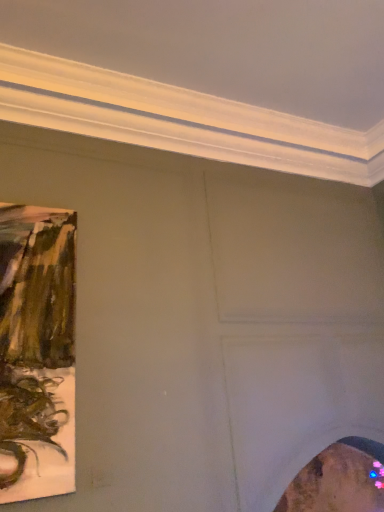
What do you see at coordinates (37, 351) in the screenshot? The image size is (384, 512). I see `matte brown painting at left, the 1th picture frame positioned from the left` at bounding box center [37, 351].

Where is `matte brown painting at left, which is the 2th picture frame from bottom to top`? Image resolution: width=384 pixels, height=512 pixels. matte brown painting at left, which is the 2th picture frame from bottom to top is located at coordinates (37, 351).

I want to click on wooden frame at lower right, which is the 2th picture frame in front-to-back order, so click(x=339, y=480).

The height and width of the screenshot is (512, 384). Describe the element at coordinates (339, 480) in the screenshot. I see `wooden frame at lower right, which ranks as the first picture frame in bottom-to-top order` at that location.

In order to click on matte brown painting at left, the 1th picture frame positioned from the left in this screenshot , I will do `click(37, 351)`.

Does matte brown painting at left, which is the 2th picture frame in back-to-front order, appear on the right side of wooden frame at lower right, arranged as the 1th picture frame when viewed from the back?

No, matte brown painting at left, which is the 2th picture frame in back-to-front order, is not to the right of wooden frame at lower right, arranged as the 1th picture frame when viewed from the back.

Between matte brown painting at left, which is the 2th picture frame in back-to-front order, and wooden frame at lower right, which ranks as the first picture frame in bottom-to-top order, which one is positioned in front?

Positioned in front is matte brown painting at left, which is the 2th picture frame in back-to-front order.

Which point is more forward, (73, 482) or (366, 444)?

Point (73, 482)

Based on the photo, from the image's perspective, which is below, matte brown painting at left, which is the first picture frame in front-to-back order, or wooden frame at lower right, the 2th picture frame viewed from the left?

From the image's view, wooden frame at lower right, the 2th picture frame viewed from the left, is below.

From a real-world perspective, between matte brown painting at left, which is the 2th picture frame in back-to-front order, and wooden frame at lower right, the 2th picture frame viewed from the left, who is vertically higher?

matte brown painting at left, which is the 2th picture frame in back-to-front order, from a real-world perspective.

Is matte brown painting at left, which is the first picture frame in front-to-back order, thinner than wooden frame at lower right, which ranks as the first picture frame in right-to-left order?

Indeed, matte brown painting at left, which is the first picture frame in front-to-back order, has a lesser width compared to wooden frame at lower right, which ranks as the first picture frame in right-to-left order.

Does matte brown painting at left, the 1th picture frame positioned from the left, have a lesser height compared to wooden frame at lower right, the 2th picture frame viewed from the left?

In fact, matte brown painting at left, the 1th picture frame positioned from the left, may be taller than wooden frame at lower right, the 2th picture frame viewed from the left.

In terms of size, does matte brown painting at left, which is the 2th picture frame in back-to-front order, appear bigger or smaller than wooden frame at lower right, which is the 2th picture frame in front-to-back order?

In the image, matte brown painting at left, which is the 2th picture frame in back-to-front order, appears to be smaller than wooden frame at lower right, which is the 2th picture frame in front-to-back order.

Can we say matte brown painting at left, which is the 2th picture frame in back-to-front order, lies outside wooden frame at lower right, which is the 2th picture frame in front-to-back order?

That's correct, matte brown painting at left, which is the 2th picture frame in back-to-front order, is outside of wooden frame at lower right, which is the 2th picture frame in front-to-back order.

Is matte brown painting at left, the second picture frame in the right-to-left sequence, touching wooden frame at lower right, the 2th picture frame viewed from the left?

No.

Does matte brown painting at left, which is the first picture frame in front-to-back order, turn towards wooden frame at lower right, the 2th picture frame viewed from the left?

No, matte brown painting at left, which is the first picture frame in front-to-back order, is not oriented towards wooden frame at lower right, the 2th picture frame viewed from the left.

This screenshot has width=384, height=512. Identify the location of picture frame in front of the wooden frame at lower right, arranged as the 1th picture frame when viewed from the back. (37, 351).

Does wooden frame at lower right, which ranks as the first picture frame in right-to-left order, appear on the left side of matte brown painting at left, which is the 2th picture frame from bottom to top?

No, wooden frame at lower right, which ranks as the first picture frame in right-to-left order, is not to the left of matte brown painting at left, which is the 2th picture frame from bottom to top.

Which object is more forward, wooden frame at lower right, which ranks as the first picture frame in bottom-to-top order, or matte brown painting at left, which is the first picture frame in front-to-back order?

matte brown painting at left, which is the first picture frame in front-to-back order, is in front.

Does point (338, 447) come closer to viewer compared to point (37, 272)?

No.

From the image's perspective, is wooden frame at lower right, which ranks as the first picture frame in right-to-left order, on matte brown painting at left, which is the 2th picture frame in back-to-front order?

Incorrect, from the image's perspective, wooden frame at lower right, which ranks as the first picture frame in right-to-left order, is lower than matte brown painting at left, which is the 2th picture frame in back-to-front order.

From a real-world perspective, is wooden frame at lower right, which ranks as the first picture frame in right-to-left order, physically above matte brown painting at left, which is the first picture frame in front-to-back order?

No.

Is wooden frame at lower right, which ranks as the first picture frame in bottom-to-top order, wider than matte brown painting at left, positioned as the first picture frame in top-to-bottom order?

Correct, the width of wooden frame at lower right, which ranks as the first picture frame in bottom-to-top order, exceeds that of matte brown painting at left, positioned as the first picture frame in top-to-bottom order.

Consider the image. Which of these two, wooden frame at lower right, which ranks as the first picture frame in right-to-left order, or matte brown painting at left, positioned as the first picture frame in top-to-bottom order, stands taller?

matte brown painting at left, positioned as the first picture frame in top-to-bottom order, is taller.

Who is smaller, wooden frame at lower right, arranged as the 1th picture frame when viewed from the back, or matte brown painting at left, positioned as the first picture frame in top-to-bottom order?

matte brown painting at left, positioned as the first picture frame in top-to-bottom order.

Which is correct: wooden frame at lower right, the 2th picture frame viewed from the left, is inside matte brown painting at left, the 1th picture frame positioned from the left, or outside of it?

wooden frame at lower right, the 2th picture frame viewed from the left, is spatially situated outside matte brown painting at left, the 1th picture frame positioned from the left.

Is wooden frame at lower right, which is the 2th picture frame in front-to-back order, with matte brown painting at left, the 1th picture frame positioned from the left?

No, wooden frame at lower right, which is the 2th picture frame in front-to-back order, is not beside matte brown painting at left, the 1th picture frame positioned from the left.

Does wooden frame at lower right, positioned as the second picture frame in top-to-bottom order, turn towards matte brown painting at left, which is the 2th picture frame from bottom to top?

No, wooden frame at lower right, positioned as the second picture frame in top-to-bottom order, does not turn towards matte brown painting at left, which is the 2th picture frame from bottom to top.

This screenshot has width=384, height=512. In order to click on picture frame that is under the matte brown painting at left, the second picture frame in the right-to-left sequence (from a real-world perspective) in this screenshot , I will do `click(339, 480)`.

Find the location of a particular element. picture frame above the wooden frame at lower right, arranged as the 1th picture frame when viewed from the back (from the image's perspective) is located at coordinates (37, 351).

Find the location of a particular element. The image size is (384, 512). picture frame below the matte brown painting at left, which is the 2th picture frame in back-to-front order (from the image's perspective) is located at coordinates (339, 480).